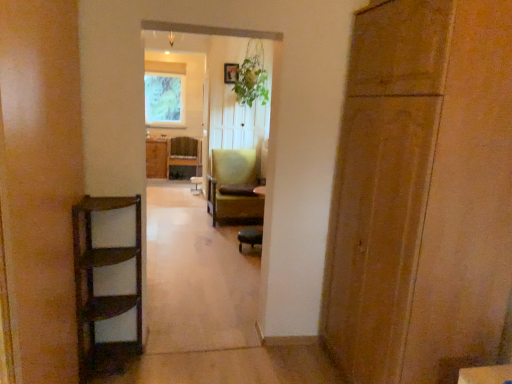
Question: Is green textured fabric at upper center wider or thinner than green fabric chair at center, which is the second chair from back to front?

Choices:
 (A) thin
 (B) wide

Answer: (A)

Question: From a real-world perspective, relative to green fabric chair at center, the 2th chair from the right, is green textured fabric at upper center vertically above or below?

Choices:
 (A) above
 (B) below

Answer: (A)

Question: Considering the real-world distances, which object is farthest from the matte black chair at center, which ranks as the first chair in right-to-left order?

Choices:
 (A) matte brown cabinet at center
 (B) wooden door at right
 (C) wooden chair at center, acting as the first chair starting from the back
 (D) green leafy plant at center
 (E) green fabric chair at center, positioned as the 2th chair in front-to-back order

Answer: (A)

Question: Based on their relative distances, which object is farther from the matte black chair at center, which ranks as the first chair in right-to-left order?

Choices:
 (A) green fabric chair at center, which is the second chair in left-to-right order
 (B) green textured fabric at upper center
 (C) wooden door at right
 (D) matte brown cabinet at center
 (E) wooden chair at center, arranged as the 3th chair when viewed from the right

Answer: (B)